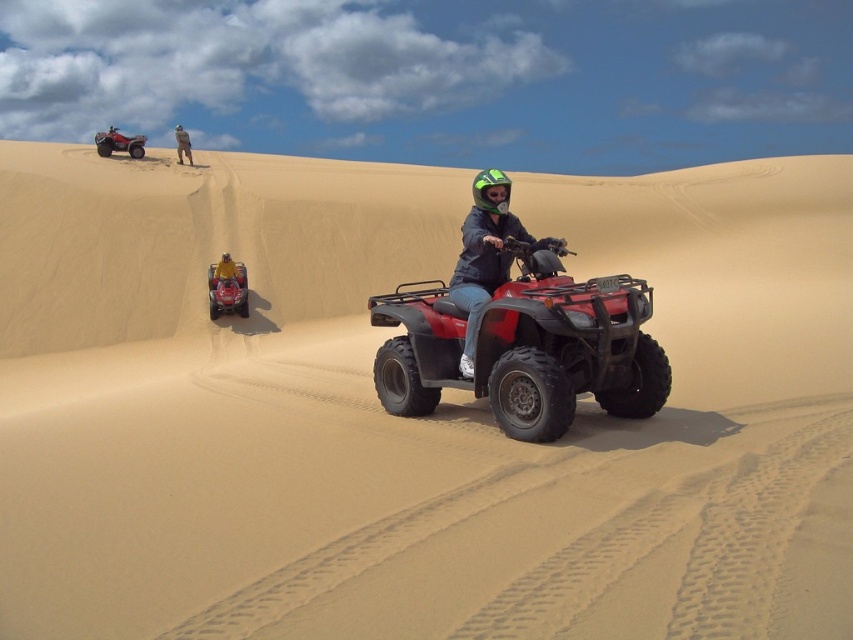
Does matte red quad bike at upper left have a lesser height compared to green matte helmet at center?

No, matte red quad bike at upper left is not shorter than green matte helmet at center.

Does matte red quad bike at upper left appear under green matte helmet at center?

No, matte red quad bike at upper left is not below green matte helmet at center.

The height and width of the screenshot is (640, 853). What do you see at coordinates (119, 141) in the screenshot?
I see `matte red quad bike at upper left` at bounding box center [119, 141].

Where is `matte red quad bike at upper left`? matte red quad bike at upper left is located at coordinates (119, 141).

Does point (474, 186) come farther from viewer compared to point (115, 134)?

No, it is in front of (115, 134).

Identify the location of shiny black helmet at center. (488, 188).

The height and width of the screenshot is (640, 853). What do you see at coordinates (525, 348) in the screenshot?
I see `matte red quad bike at center` at bounding box center [525, 348].

Is matte red quad bike at center smaller than matte black helmet at center?

Incorrect, matte red quad bike at center is not smaller in size than matte black helmet at center.

Locate an element on the screen. This screenshot has width=853, height=640. matte red quad bike at center is located at coordinates (525, 348).